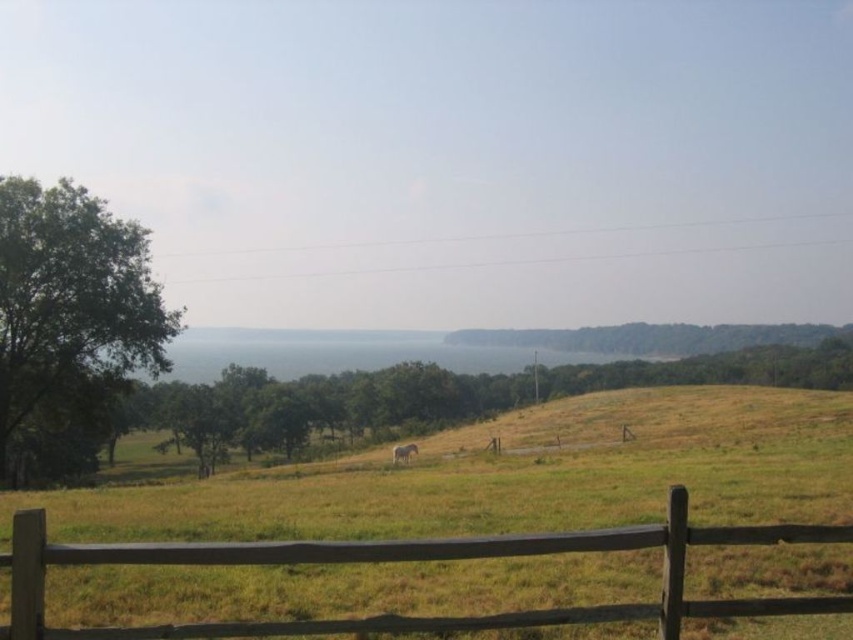
Is green leafy tree at left thinner than brown textured horse at center?

Incorrect, green leafy tree at left's width is not less than brown textured horse at center's.

Does green leafy tree at left appear over brown textured horse at center?

Yes.

The width and height of the screenshot is (853, 640). What do you see at coordinates (71, 310) in the screenshot? I see `green leafy tree at left` at bounding box center [71, 310].

Find the location of a particular element. green leafy tree at left is located at coordinates coord(71,310).

Between green leafy tree at center and green leafy tree at left, which one appears on the right side from the viewer's perspective?

Positioned to the right is green leafy tree at center.

Between point (247, 394) and point (71, 250), which one is positioned behind?

Point (247, 394)

You are a GUI agent. You are given a task and a screenshot of the screen. Output one action in this format:
    pyautogui.click(x=<x>, y=<y>)
    Task: Click on the green leafy tree at center
    The width and height of the screenshot is (853, 640).
    Given the screenshot: What is the action you would take?
    pyautogui.click(x=432, y=397)

Can you confirm if green leafy tree at center is positioned to the right of brown textured horse at center?

Yes, green leafy tree at center is to the right of brown textured horse at center.

Does green leafy tree at center appear over brown textured horse at center?

Yes, green leafy tree at center is above brown textured horse at center.

Describe the element at coordinates (432, 397) in the screenshot. I see `green leafy tree at center` at that location.

At what (x,y) coordinates should I click in order to perform the action: click on green leafy tree at center. Please return your answer as a coordinate pair (x, y). This screenshot has width=853, height=640. Looking at the image, I should click on point(432,397).